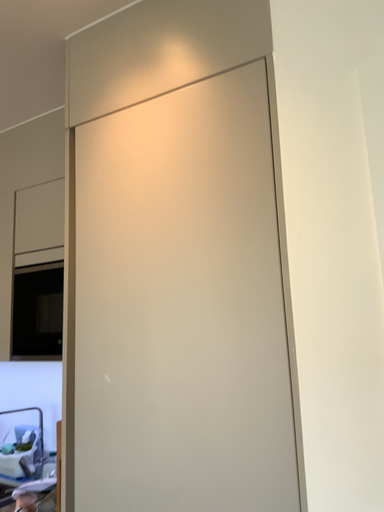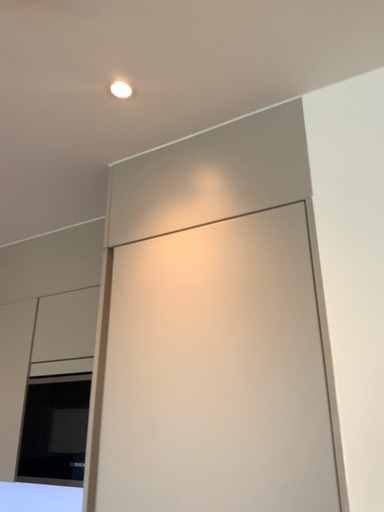
Question: How did the camera likely rotate when shooting the video?

Choices:
 (A) rotated upward
 (B) rotated downward

Answer: (A)